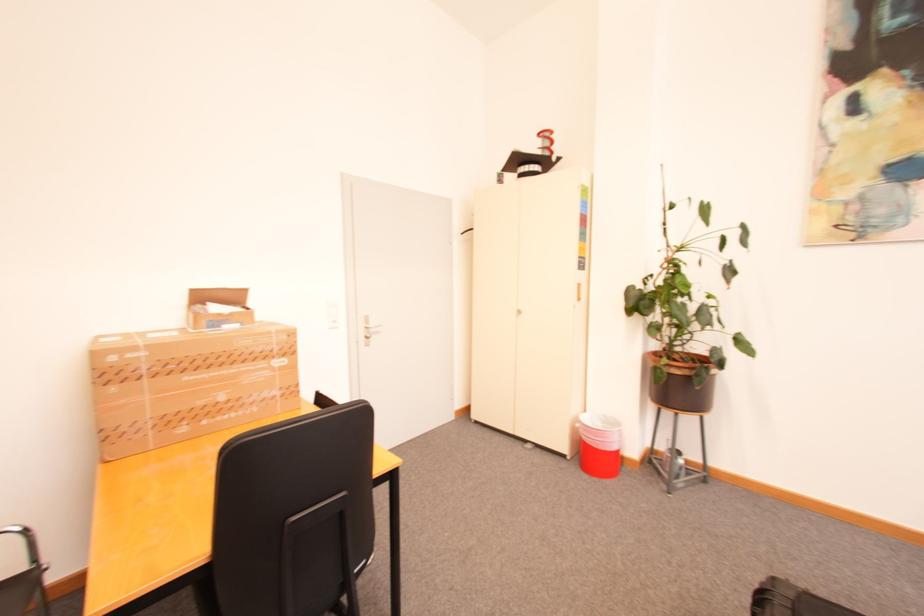
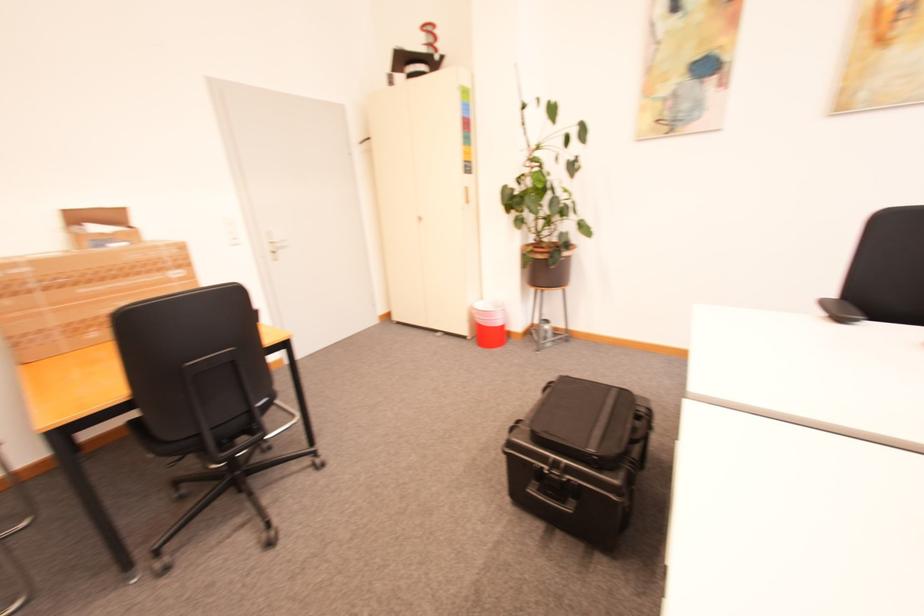
Locate, in the second image, the point that corresponds to (575,459) in the first image.

(476, 339)